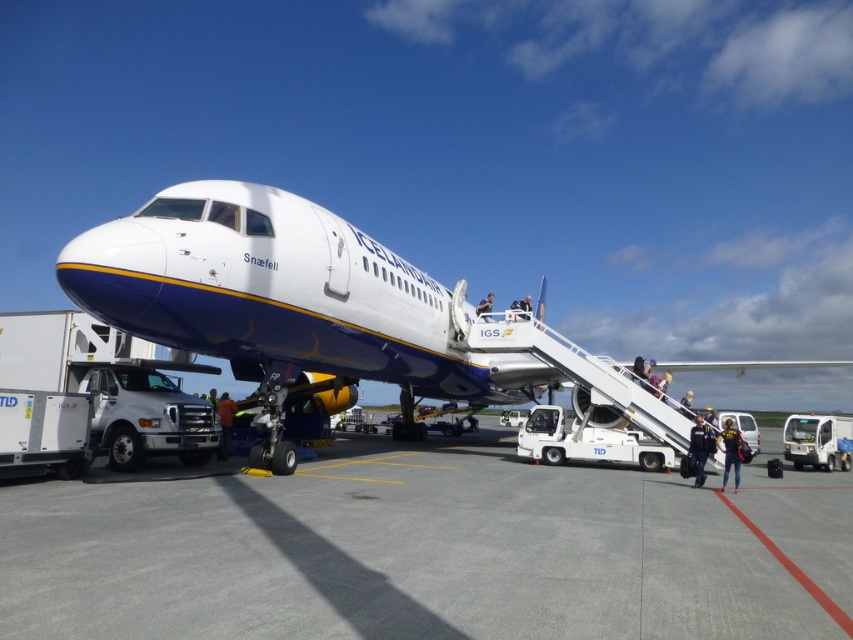
Can you confirm if gray concrete tarmac at center is positioned to the left of blue fabric jacket at upper center?

Correct, you'll find gray concrete tarmac at center to the left of blue fabric jacket at upper center.

Between gray concrete tarmac at center and blue fabric jacket at upper center, which one has more height?

Standing taller between the two is blue fabric jacket at upper center.

I want to click on gray concrete tarmac at center, so click(425, 548).

This screenshot has width=853, height=640. What do you see at coordinates (425, 548) in the screenshot? I see `gray concrete tarmac at center` at bounding box center [425, 548].

Based on the photo, which of these two, gray concrete tarmac at center or white matte airplane at center, stands shorter?

With less height is gray concrete tarmac at center.

Which is in front, point (643, 593) or point (500, 372)?

Point (643, 593) is in front.

Where is `gray concrete tarmac at center`? The image size is (853, 640). gray concrete tarmac at center is located at coordinates (425, 548).

How far apart are white matte airplane at center and orange reflective vest at lower center?

white matte airplane at center and orange reflective vest at lower center are 22.70 feet apart.

The height and width of the screenshot is (640, 853). In order to click on white matte airplane at center in this screenshot , I will do `click(285, 296)`.